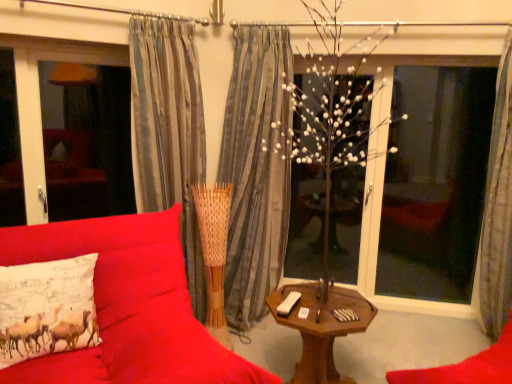
The height and width of the screenshot is (384, 512). Identify the location of transparent glass window at right, which ranks as the 2th window screen in left-to-right order. (435, 182).

Describe the element at coordinates (435, 182) in the screenshot. The image size is (512, 384). I see `transparent glass window at right, the first window screen in the right-to-left sequence` at that location.

The image size is (512, 384). What do you see at coordinates (321, 328) in the screenshot?
I see `wooden table at center` at bounding box center [321, 328].

The width and height of the screenshot is (512, 384). In order to click on striped fabric curtain at center, the 2th curtain positioned from the left in this screenshot , I will do `click(256, 170)`.

Describe the element at coordinates (306, 223) in the screenshot. The height and width of the screenshot is (384, 512). I see `white matte tree at center` at that location.

Describe the element at coordinates (129, 306) in the screenshot. I see `velvet red couch at center` at that location.

Locate an element on the screen. Image resolution: width=512 pixels, height=384 pixels. transparent glass window at right, which ranks as the 2th window screen in left-to-right order is located at coordinates (435, 182).

Can you confirm if gray striped curtain at right, arranged as the first curtain when viewed from the right, is taller than white printed pillow at left?

Correct, gray striped curtain at right, arranged as the first curtain when viewed from the right, is much taller as white printed pillow at left.

Are gray striped curtain at right, arranged as the first curtain when viewed from the right, and white printed pillow at left making contact?

No.

Between gray striped curtain at right, arranged as the first curtain when viewed from the right, and white printed pillow at left, which one has smaller width?

With smaller width is white printed pillow at left.

Is gray striped curtain at right, arranged as the first curtain when viewed from the right, further to the viewer compared to white printed pillow at left?

Yes, it is.

Image resolution: width=512 pixels, height=384 pixels. Identify the location of studio couch that appears below the matte glass window screen at left, placed as the 2th window screen when sorted from right to left (from the image's perspective). (129, 306).

Can you confirm if velvet red couch at center is positioned to the right of matte glass window screen at left, placed as the 2th window screen when sorted from right to left?

Yes, velvet red couch at center is to the right of matte glass window screen at left, placed as the 2th window screen when sorted from right to left.

Which is behind, velvet red couch at center or matte glass window screen at left, the first window screen in the left-to-right sequence?

matte glass window screen at left, the first window screen in the left-to-right sequence, is more distant.

Which is behind, point (164, 316) or point (18, 80)?

The point (18, 80) is farther from the camera.

Would you say white matte tree at center contains transparent glass window at right, which ranks as the 2th window screen in left-to-right order?

That's incorrect, transparent glass window at right, which ranks as the 2th window screen in left-to-right order, is not inside white matte tree at center.

Is white matte tree at center positioned with its back to transparent glass window at right, the first window screen in the right-to-left sequence?

That's not correct — white matte tree at center is not looking away from transparent glass window at right, the first window screen in the right-to-left sequence.

Does white matte tree at center have a smaller size compared to transparent glass window at right, which ranks as the 2th window screen in left-to-right order?

Yes, white matte tree at center is smaller than transparent glass window at right, which ranks as the 2th window screen in left-to-right order.

Looking at this image, can you confirm if white matte tree at center is positioned to the left of transparent glass window at right, the first window screen in the right-to-left sequence?

Yes.

At what (x,y) coordinates should I click in order to perform the action: click on pillow to the left of velvet red couch at center. Please return your answer as a coordinate pair (x, y). Looking at the image, I should click on 47,308.

From the image's perspective, does white printed pillow at left appear lower than velvet red couch at center?

Actually, white printed pillow at left appears above velvet red couch at center in the image.

Considering the positions of objects white printed pillow at left and velvet red couch at center in the image provided, who is more to the right, white printed pillow at left or velvet red couch at center?

velvet red couch at center is more to the right.

In the scene shown: Is white printed pillow at left next to velvet red couch at center?

white printed pillow at left and velvet red couch at center are clearly separated.

In terms of width, does transparent glass window at right, which ranks as the 2th window screen in left-to-right order, look wider or thinner when compared to velvet red couch at center?

Considering their sizes, transparent glass window at right, which ranks as the 2th window screen in left-to-right order, looks slimmer than velvet red couch at center.

What's the angular difference between transparent glass window at right, the first window screen in the right-to-left sequence, and velvet red couch at center's facing directions?

transparent glass window at right, the first window screen in the right-to-left sequence, and velvet red couch at center are facing 40.7 degrees away from each other.

Which object is further away from the camera, transparent glass window at right, the first window screen in the right-to-left sequence, or velvet red couch at center?

transparent glass window at right, the first window screen in the right-to-left sequence, is further away from the camera.

Which is in front, velvet red couch at center or transparent glass window at right, the first window screen in the right-to-left sequence?

velvet red couch at center is more forward.

Is velvet red couch at center in contact with transparent glass window at right, which ranks as the 2th window screen in left-to-right order?

No.

Which of these two, velvet red couch at center or transparent glass window at right, the first window screen in the right-to-left sequence, stands taller?

With more height is transparent glass window at right, the first window screen in the right-to-left sequence.

Between white printed pillow at left and striped fabric curtain at center, the 2th curtain positioned from the right, which one has less height?

white printed pillow at left is shorter.

Is white printed pillow at left wider than striped fabric curtain at center, the 2th curtain positioned from the right?

In fact, white printed pillow at left might be narrower than striped fabric curtain at center, the 2th curtain positioned from the right.

Could you tell me if white printed pillow at left is turned towards striped fabric curtain at center, the 2th curtain positioned from the left?

No, white printed pillow at left is not facing towards striped fabric curtain at center, the 2th curtain positioned from the left.

Can you see white printed pillow at left touching striped fabric curtain at center, the 2th curtain positioned from the left?

white printed pillow at left and striped fabric curtain at center, the 2th curtain positioned from the left, are not in contact.

Image resolution: width=512 pixels, height=384 pixels. Identify the location of pillow below the gray striped curtain at right, positioned as the third curtain in left-to-right order (from a real-world perspective). coord(47,308).

The image size is (512, 384). I want to click on the 2nd window screen above the velvet red couch at center (from the image's perspective), so click(x=39, y=99).

When comparing their distances from striped fabric curtain at center, the 2th curtain positioned from the right, does transparent glass window at right, the first window screen in the right-to-left sequence, or matte glass window screen at left, placed as the 2th window screen when sorted from right to left, seem closer?

matte glass window screen at left, placed as the 2th window screen when sorted from right to left, lies closer to striped fabric curtain at center, the 2th curtain positioned from the right, than the other object.

Considering their positions, is gray striped curtain at right, arranged as the first curtain when viewed from the right, positioned closer to striped fabric curtain at center, the 2th curtain positioned from the left, than wooden table at center?

wooden table at center.

From the picture: Looking at the image, which one is located closer to gray striped curtain at right, positioned as the third curtain in left-to-right order, striped fabric curtain at center, the 2th curtain positioned from the right, or transparent glass window at right, which ranks as the 2th window screen in left-to-right order?

transparent glass window at right, which ranks as the 2th window screen in left-to-right order.

Which object lies further to the anchor point matte glass window screen at left, the first window screen in the left-to-right sequence, white matte tree at center or silky gray curtain at left, marked as the 3th curtain in a right-to-left arrangement?

white matte tree at center is further to matte glass window screen at left, the first window screen in the left-to-right sequence.

When comparing their distances from wooden table at center, does matte glass window screen at left, placed as the 2th window screen when sorted from right to left, or silky gray curtain at left, marked as the 3th curtain in a right-to-left arrangement, seem further?

matte glass window screen at left, placed as the 2th window screen when sorted from right to left, is positioned further to the anchor wooden table at center.

Considering their positions, is velvet red couch at center positioned closer to silky gray curtain at left, marked as the 3th curtain in a right-to-left arrangement, than striped fabric curtain at center, the 2th curtain positioned from the right?

striped fabric curtain at center, the 2th curtain positioned from the right, is positioned closer to the anchor silky gray curtain at left, marked as the 3th curtain in a right-to-left arrangement.

Which object lies nearer to the anchor point striped fabric curtain at center, the 2th curtain positioned from the left, transparent glass window at right, the first window screen in the right-to-left sequence, or white matte tree at center?

white matte tree at center is positioned closer to the anchor striped fabric curtain at center, the 2th curtain positioned from the left.

Looking at the image, which one is located further to transparent glass window at right, the first window screen in the right-to-left sequence, gray striped curtain at right, arranged as the first curtain when viewed from the right, or velvet red couch at center?

Among the two, velvet red couch at center is located further to transparent glass window at right, the first window screen in the right-to-left sequence.

Identify the location of pillow positioned between velvet red couch at center and white matte tree at center from near to far. Image resolution: width=512 pixels, height=384 pixels. (47, 308).

Identify the location of table between white printed pillow at left and transparent glass window at right, which ranks as the 2th window screen in left-to-right order, from left to right. (321, 328).

Locate an element on the screen. pillow between velvet red couch at center and matte glass window screen at left, the first window screen in the left-to-right sequence, in the front-back direction is located at coordinates (47, 308).

Find the location of a particular element. This screenshot has height=384, width=512. window screen situated between velvet red couch at center and gray striped curtain at right, arranged as the first curtain when viewed from the right, from left to right is located at coordinates (435, 182).